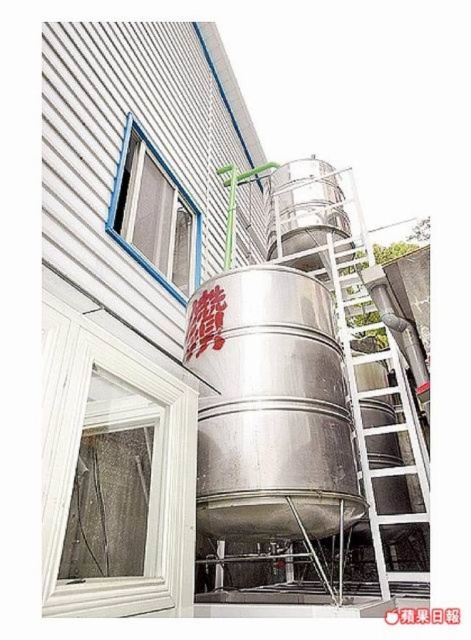
In the scene shown: You are a maintenance worker needing to reach the blue plastic window at upper left to inspect it. There is a metallic ladder at right nearby. Can you use the ladder to access the window?

The metallic ladder at right is in front of the blue plastic window at upper left, so you can use the ladder to access the window since it is positioned in front of it.

You are an inspector needing to access the tank for maintenance. You have a tool that requires a minimum width of 1.2 meters to pass through. Can you use the path between the metallic ladder at right and the blue plastic window at upper left?

The metallic ladder at right is wider than the blue plastic window at upper left. Since the ladder is wider, the path between them might be narrower than the ladder itself. However, without specific path width information, it is impossible to confirm if it meets the 1.2 meter requirement. Please measure the actual width on site.

You are a maintenance worker needing to access the top of the metallic ladder at right. You have a tool that requires you to pass through the blue plastic window at upper left. Will the tool fit through the window if it is as large as the ladder?

The metallic ladder at right has a larger size compared to the blue plastic window at upper left. Since the tool is as large as the ladder, it will not fit through the window.